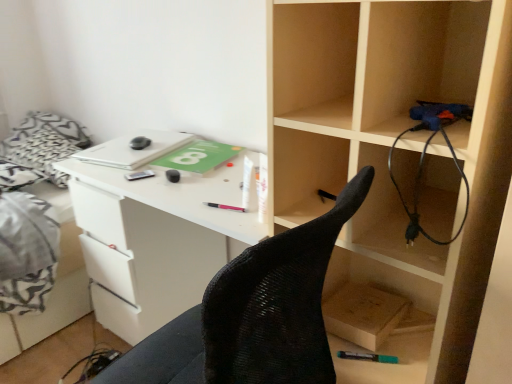
This screenshot has width=512, height=384. In order to click on vacant point to the left of black rubber mouse at center, which is the 1th stationery from top to bottom in this screenshot , I will do `click(134, 171)`.